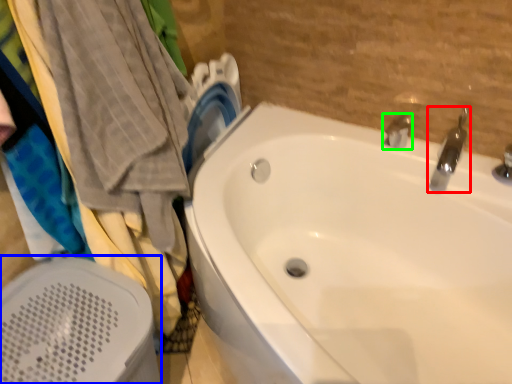
Question: Which object is the closest to the tap (highlighted by a red box)? Choose among these: bath heater (highlighted by a blue box) or tap (highlighted by a green box).

Choices:
 (A) bath heater
 (B) tap

Answer: (B)